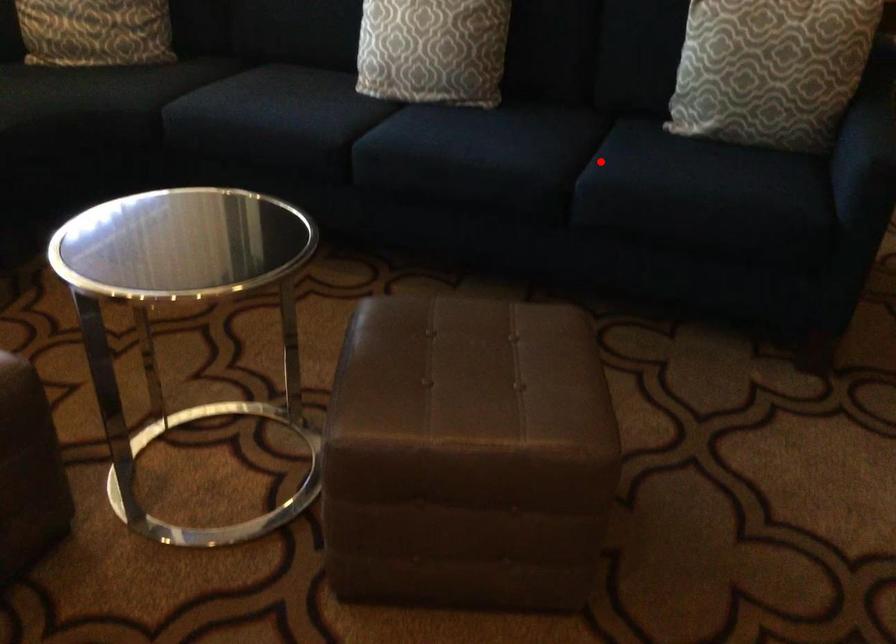
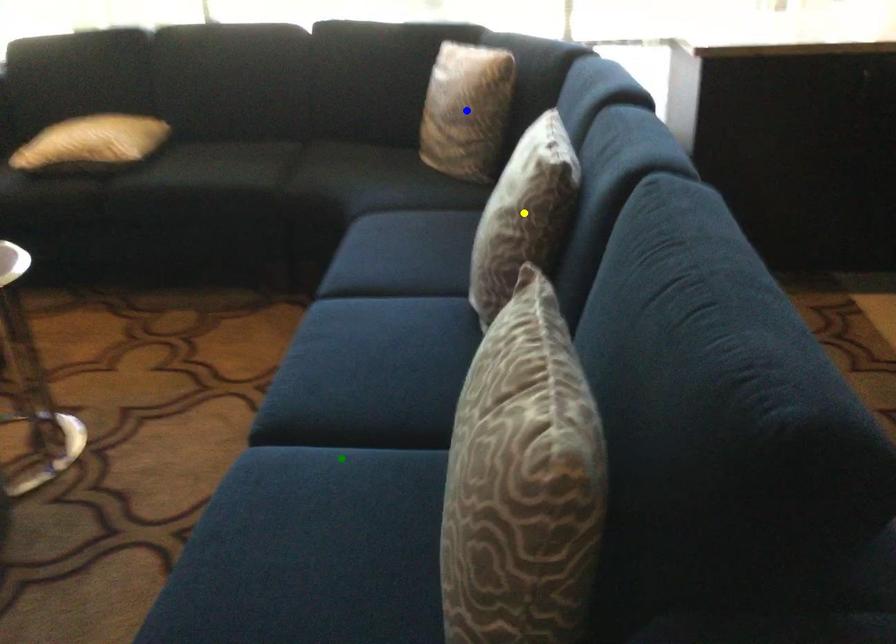
Question: I am providing you with two images of the same scene from different viewpoints. A red point is marked on the first image. You are given multiple points on the second image. Which point in image 2 is actually the same real-world point as the red point in image 1?

Choices:
 (A) green point
 (B) yellow point
 (C) blue point

Answer: (A)